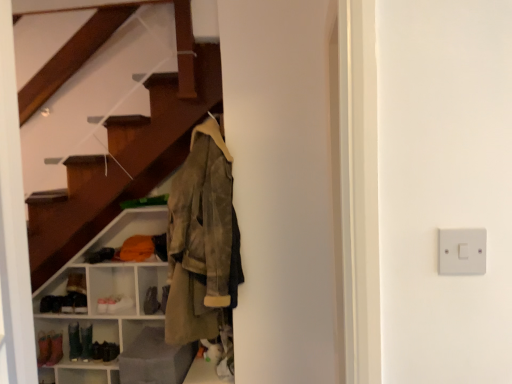
Question: From a real-world perspective, is leather shoe at lower left physically located above or below white plastic switch at right?

Choices:
 (A) below
 (B) above

Answer: (A)

Question: Which is correct: leather shoe at lower left is inside white plastic switch at right, or outside of it?

Choices:
 (A) outside
 (B) inside

Answer: (A)

Question: Based on their relative distances, which object is nearer to the white plastic switch at right?

Choices:
 (A) matte gray ottoman at lower left
 (B) leather shoe at lower left
 (C) olive suede jacket at center
 (D) matte white shelving unit at lower left

Answer: (C)

Question: Which object is positioned closest to the matte white shelving unit at lower left?

Choices:
 (A) leather shoe at lower left
 (B) white plastic switch at right
 (C) olive suede jacket at center
 (D) matte gray ottoman at lower left

Answer: (A)